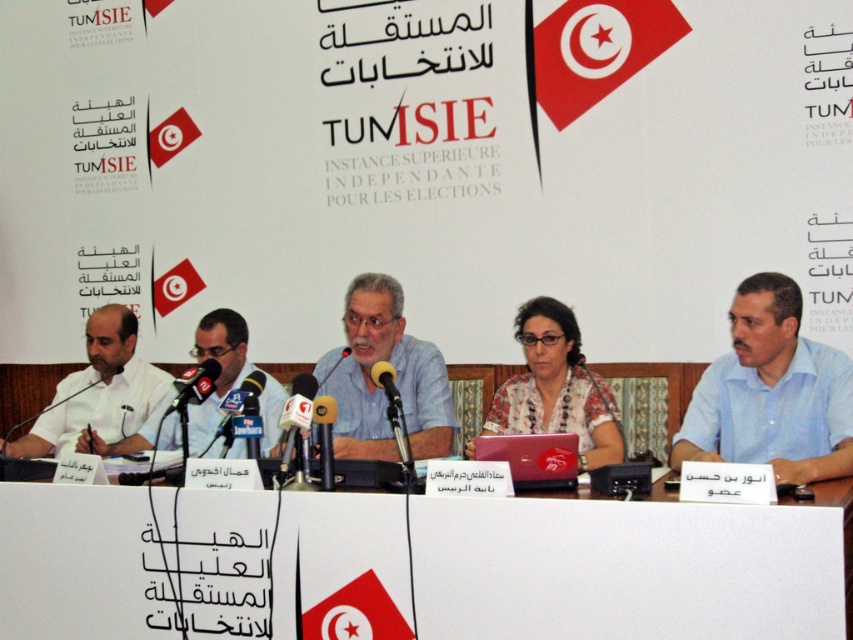
Does gray fabric shirt at center have a greater width compared to metallic microphones at center?

Indeed, gray fabric shirt at center has a greater width compared to metallic microphones at center.

Does gray fabric shirt at center appear on the left side of metallic microphones at center?

No, gray fabric shirt at center is not to the left of metallic microphones at center.

Between point (428, 456) and point (180, 403), which one is positioned behind?

The point (428, 456) is more distant.

The height and width of the screenshot is (640, 853). Identify the location of gray fabric shirt at center. (396, 380).

Does floral fabric shirt at center have a lesser height compared to metallic/metallic microphone at center?

Incorrect, floral fabric shirt at center's height does not fall short of metallic/metallic microphone at center's.

Who is positioned more to the right, floral fabric shirt at center or metallic/metallic microphone at center?

floral fabric shirt at center

Does point (587, 404) lie in front of point (375, 372)?

No, it is behind (375, 372).

Locate an element on the screen. The width and height of the screenshot is (853, 640). floral fabric shirt at center is located at coordinates (556, 387).

Does white paper at left have a larger size compared to metallic silver microphone at center?

Yes.

Measure the distance between point (227, 333) and camera.

3.70 meters

Where is `white paper at left`? This screenshot has width=853, height=640. white paper at left is located at coordinates (219, 371).